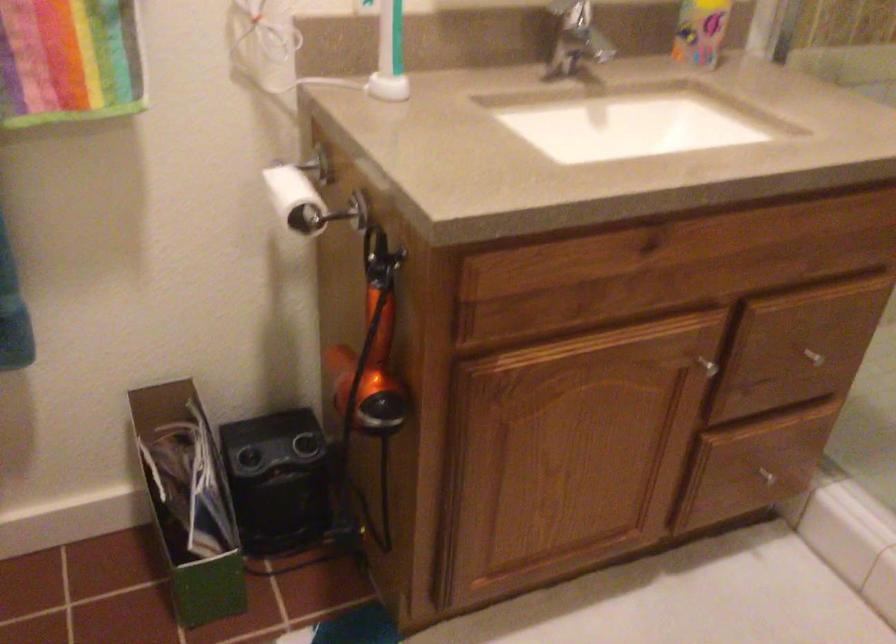
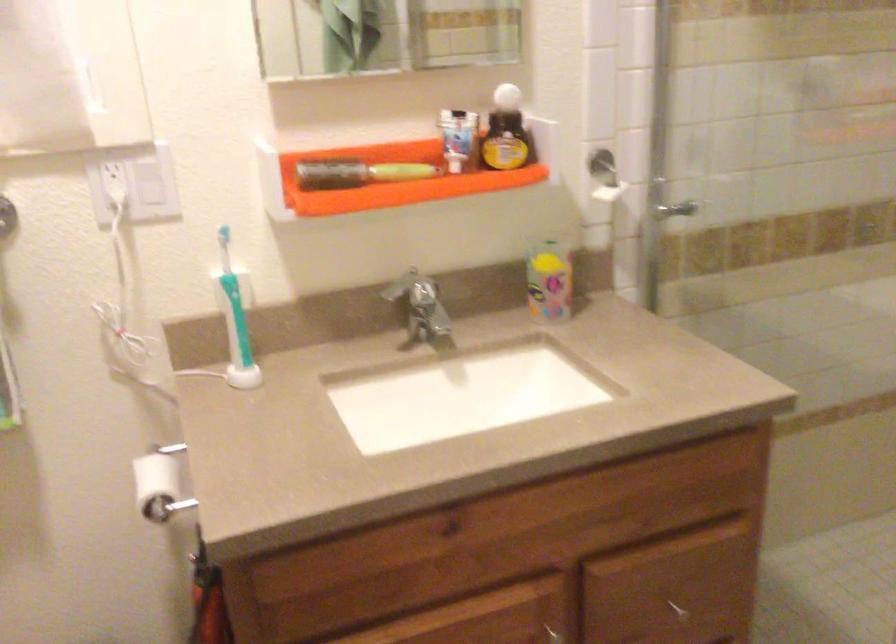
Question: What movement of the cameraman would produce the second image?

Choices:
 (A) Left
 (B) Right
 (C) Forward
 (D) Backward

Answer: (B)